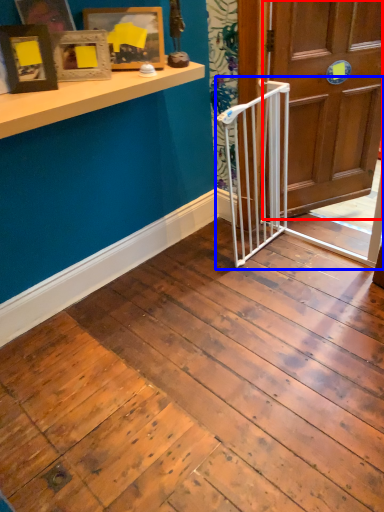
Question: Which point is further to the camera, door (highlighted by a red box) or rail (highlighted by a blue box)?

Choices:
 (A) door
 (B) rail

Answer: (A)